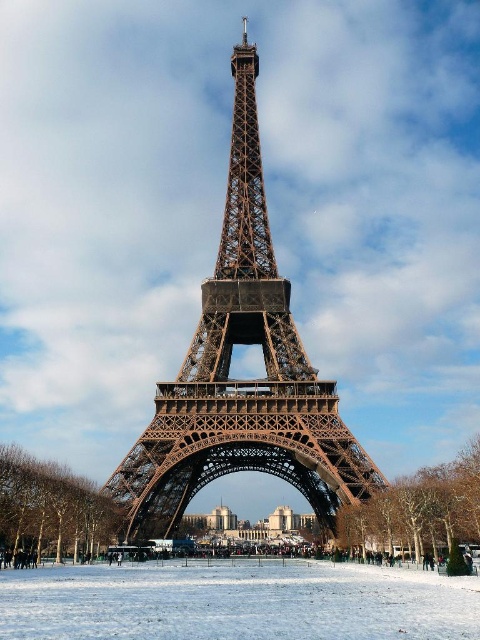
You are a photographer planning to take a photo of the brown metallic eiffel tower at center and the white powdery snow at center. Based on their sizes in the image, which one would appear larger in your photo?

The brown metallic eiffel tower at center is taller than the white powdery snow at center, so it would appear larger in the photo.

From the picture: You are a tourist standing in front of the brown metallic eiffel tower at center and the white powdery snow at center. Which object is closer to you?

The brown metallic eiffel tower at center is closer to you because the white powdery snow at center is behind it.

You are a photographer standing on the white powdery snow at center, aiming to capture the brown metallic eiffel tower at center in your shot. Given that your camera has a maximum focus range of 25 meters, will you be able to focus on the tower?

The distance between the brown metallic eiffel tower at center and the white powdery snow at center is 24.71 meters, which is within the camera maximum focus range of 25 meters. Therefore, the photographer can focus on the tower.